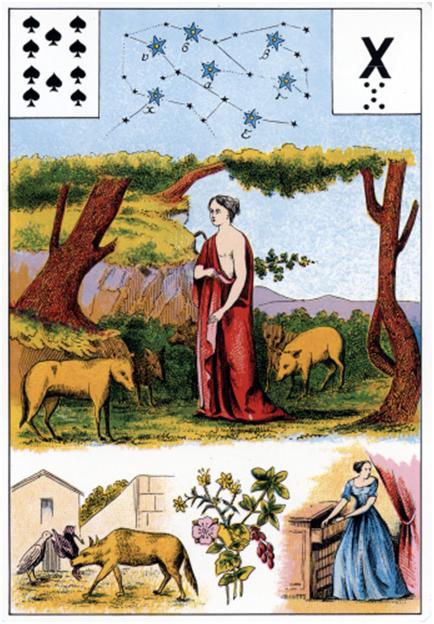
Find the location of a particular element. The width and height of the screenshot is (434, 624). drawers is located at coordinates (299, 544).